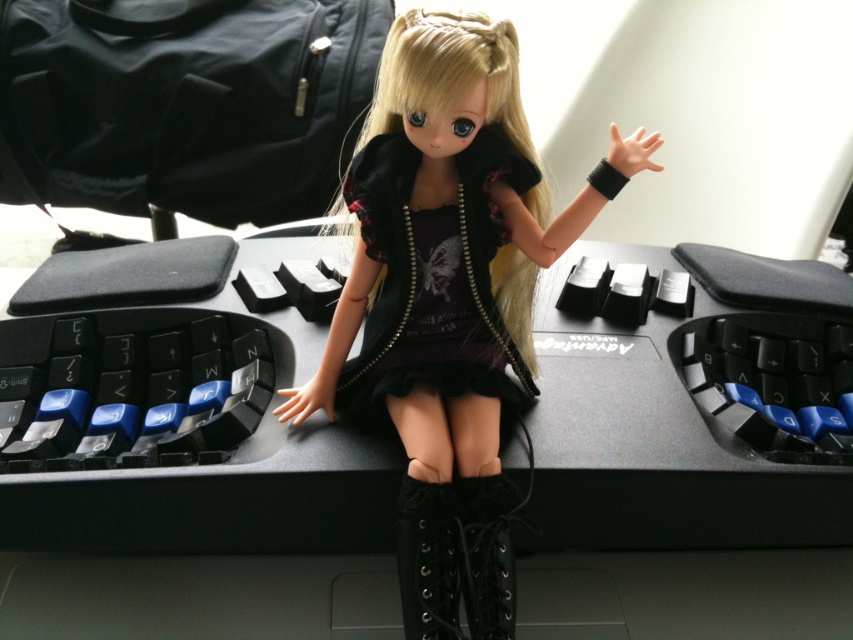
Does matte black doll at center have a lesser height compared to black leather boot at lower center?

No.

Does point (498, 348) come in front of point (445, 506)?

No, (498, 348) is further to viewer.

Identify the location of matte black doll at center. The image size is (853, 640). (447, 244).

Does black matte dress at center have a smaller size compared to black leather boot at lower center?

No.

Who is positioned more to the left, black matte dress at center or black leather boot at lower center?

black leather boot at lower center is more to the left.

Does point (469, 257) come behind point (415, 486)?

Yes, it is.

You are a GUI agent. You are given a task and a screenshot of the screen. Output one action in this format:
    pyautogui.click(x=<x>, y=<y>)
    Task: Click on the black matte dress at center
    
    Given the screenshot: What is the action you would take?
    pyautogui.click(x=422, y=269)

Looking at this image, does black matte computer desk at center appear on the right side of black leather boot at center?

Incorrect, black matte computer desk at center is not on the right side of black leather boot at center.

Does black matte computer desk at center have a lesser width compared to black leather boot at center?

In fact, black matte computer desk at center might be wider than black leather boot at center.

The image size is (853, 640). What do you see at coordinates (184, 456) in the screenshot?
I see `black matte computer desk at center` at bounding box center [184, 456].

Identify the location of black matte computer desk at center. (184, 456).